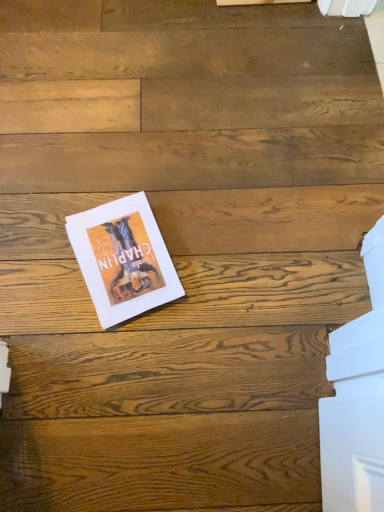
At what (x,y) coordinates should I click in order to perform the action: click on vacant space to the right of white paper book at center. Please return your answer as a coordinate pair (x, y). This screenshot has height=512, width=384. Looking at the image, I should click on (216, 254).